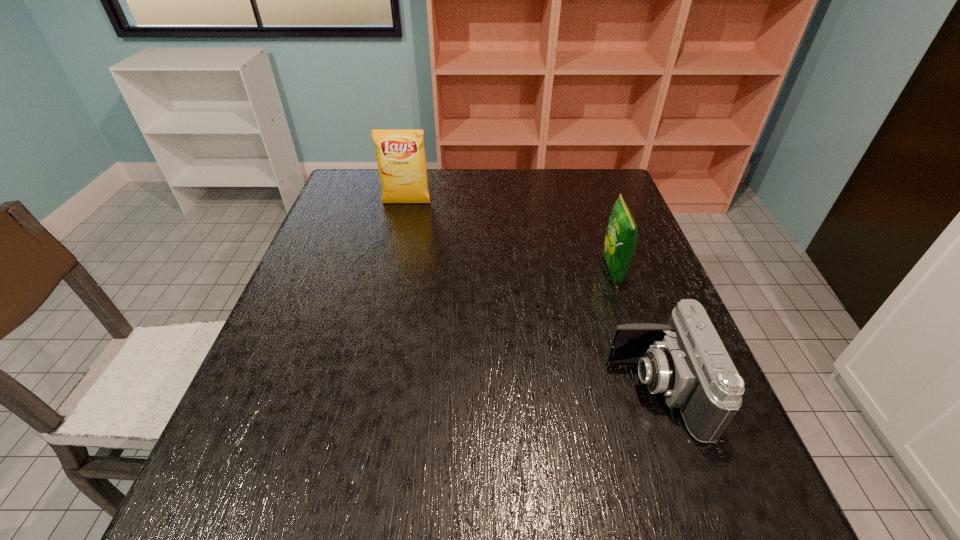
Where is `vacant space located at the front of the camera with an open lens cover`? The image size is (960, 540). vacant space located at the front of the camera with an open lens cover is located at coordinates (478, 390).

Identify the location of free spot located at the front of the camera with an open lens cover. This screenshot has width=960, height=540. (524, 390).

Identify the location of vacant point located 0.220m at the front of the camera with an open lens cover. This screenshot has height=540, width=960. (498, 390).

You are a GUI agent. You are given a task and a screenshot of the screen. Output one action in this format:
    pyautogui.click(x=<x>, y=<y>)
    Task: Click on the object present at the far edge
    This screenshot has height=540, width=960.
    Given the screenshot: What is the action you would take?
    pyautogui.click(x=400, y=153)

In order to click on object that is at the left edge in this screenshot , I will do point(400,153).

This screenshot has height=540, width=960. I want to click on crisp (potato chip) that is at the right edge, so click(x=621, y=238).

You are a GUI agent. You are given a task and a screenshot of the screen. Output one action in this format:
    pyautogui.click(x=<x>, y=<y>)
    Task: Click on the camera that is positioned at the right edge
    This screenshot has width=960, height=540.
    Given the screenshot: What is the action you would take?
    pyautogui.click(x=685, y=360)

Identify the location of object located at the far left corner. The height and width of the screenshot is (540, 960). (400, 153).

Image resolution: width=960 pixels, height=540 pixels. I want to click on vacant region at the far edge of the desktop, so click(494, 185).

Image resolution: width=960 pixels, height=540 pixels. In the image, there is a desktop. Find the location of `vacant space at the near edge`. vacant space at the near edge is located at coordinates (558, 503).